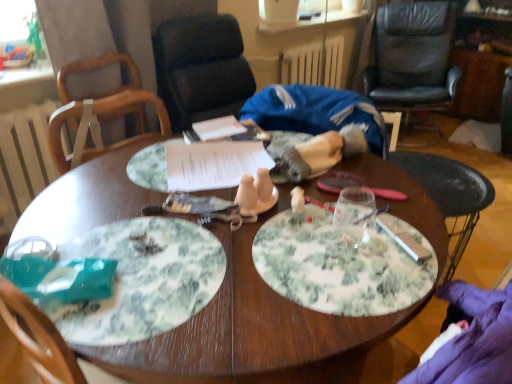
Question: Considering their positions, is green floral plate at center, which ranks as the 2th plate in top-to-bottom order, located in front of or behind wooden chair at upper left, which is the 1th chair in left-to-right order?

Choices:
 (A) front
 (B) behind

Answer: (A)

Question: Is green floral plate at center, the first plate positioned from the front, taller or shorter than wooden chair at upper left, arranged as the 2th chair when viewed from the right?

Choices:
 (A) tall
 (B) short

Answer: (B)

Question: Which object is positioned farthest from the black leather chair at upper right, acting as the second chair starting from the left?

Choices:
 (A) white painted wood radiator at left, the 2th radiator viewed from the top
 (B) floral paper plate at center, positioned as the second plate in bottom-to-top order
 (C) green floral plate at center, the first plate positioned from the front
 (D) white painted metal radiator at upper center, the first radiator positioned from the top
 (E) wooden chair at upper left, arranged as the 2th chair when viewed from the right

Answer: (C)

Question: Which of these objects is positioned closest to the floral paper plate at center, the second plate in the front-to-back sequence?

Choices:
 (A) green floral plate at center, which ranks as the 2th plate in top-to-bottom order
 (B) white crumbly food at center
 (C) white painted wood radiator at left, acting as the second radiator starting from the back
 (D) white painted metal radiator at upper center, placed as the second radiator when sorted from left to right
 (E) wooden chair at upper left, acting as the 1th chair starting from the front

Answer: (B)